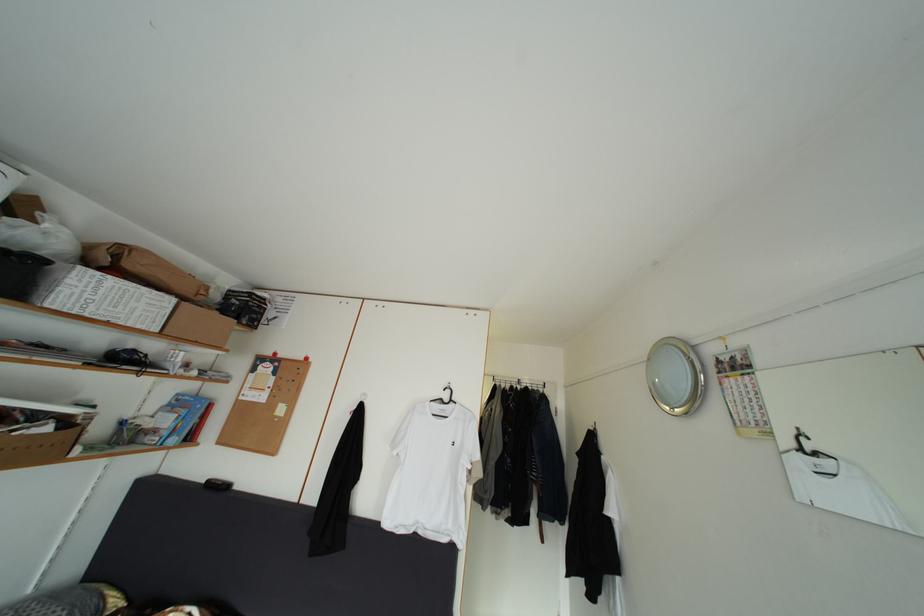
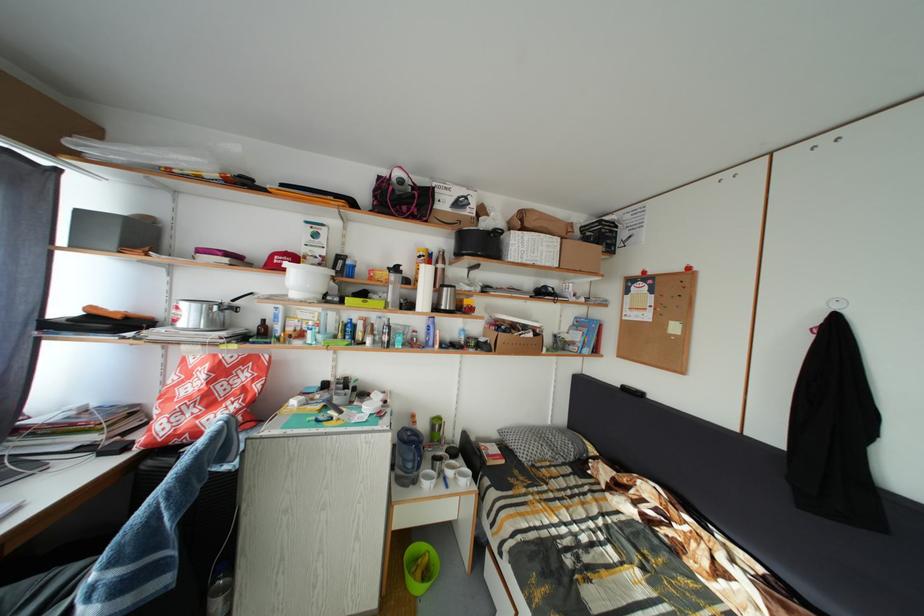
Question: Based on the continuous images, in which direction is the camera rotating? Reply with the corresponding letter.

Choices:
 (A) Left
 (B) Right
 (C) Up
 (D) Down

Answer: (A)